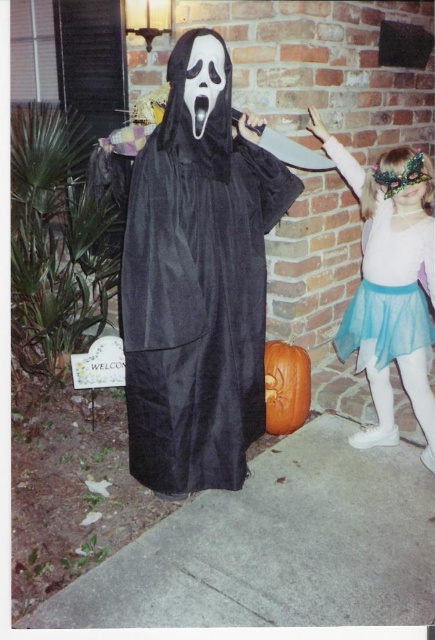
Consider the image. You are standing in a haunted house and see the velvet black ghost at center and the translucent blue skirt at right. Which costume is closer to you?

The velvet black ghost at center is closer to you because it is in front of the translucent blue skirt at right.

You are a photographer setting up for a Halloween photoshoot. You want to ensure that the velvet black ghost at center and the translucent blue skirt at right are positioned so that there is at least 30 inches of space between them for dramatic effect. Based on the scene description, is the current distance sufficient?

The velvet black ghost at center is 27.57 inches away from the translucent blue skirt at right. Since 27.57 inches is less than 30 inches, the current distance is not sufficient for the desired 30 inches of space.